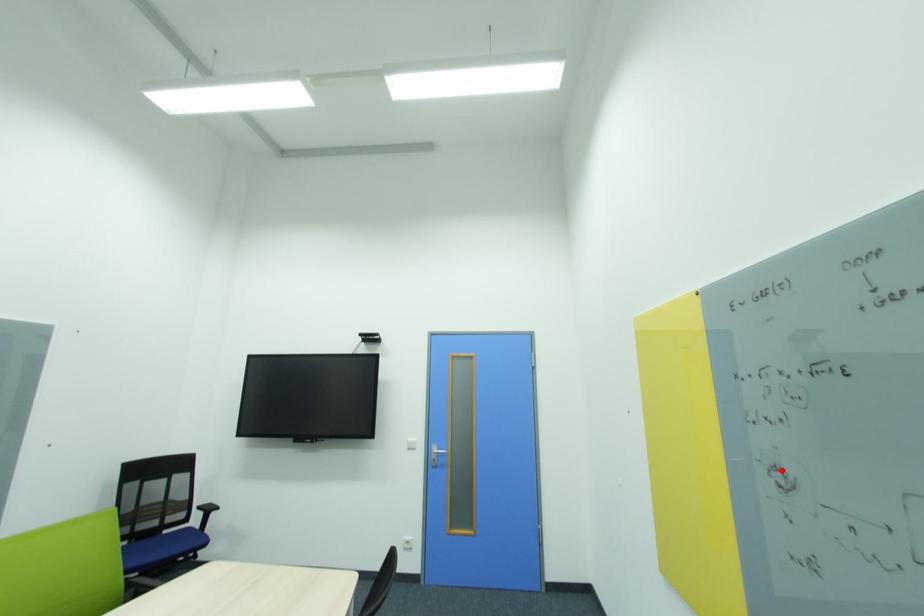
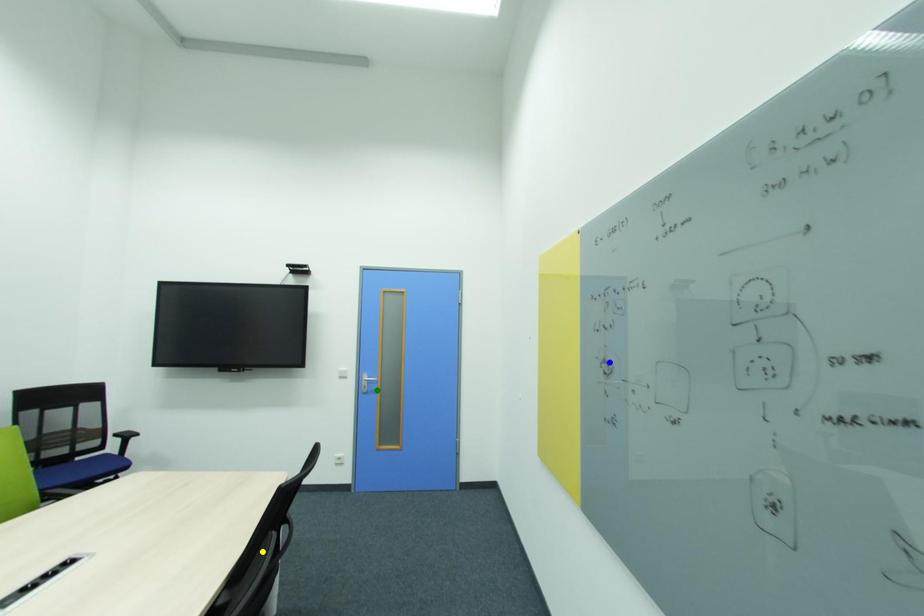
Question: I am providing you with two images of the same scene from different viewpoints. A red point is marked on the first image. You are given multiple points on the second image. In image 2, which mark is for the same physical point as the one in image 1?

Choices:
 (A) blue point
 (B) green point
 (C) yellow point

Answer: (A)